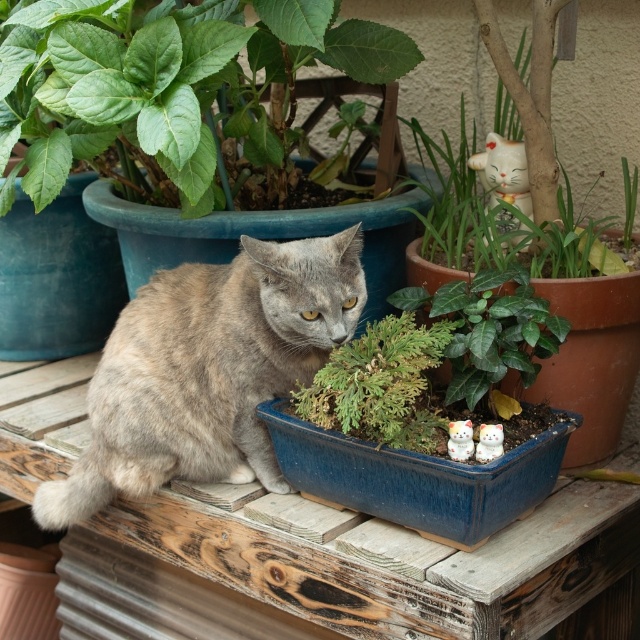
You are planning to place a new plant pot that is 15 inches wide between the green matte plant at upper left and the green matte plant at upper right. Will there be enough space?

The distance between the green matte plant at upper left and the green matte plant at upper right is 30.11 inches. Since the new plant pot is 15 inches wide, there is enough space to place it between them as 15 inches is less than 30.11 inches.

You are a photographer trying to capture a clear shot of the gray fur cat at center and the green matte plant at upper right. Since the cat is blocking the plant, can you move the cat to the side to get a better view of the plant?

The gray fur cat at center is in front of the green matte plant at upper right, so moving the cat to the side would allow a clearer view of the plant.